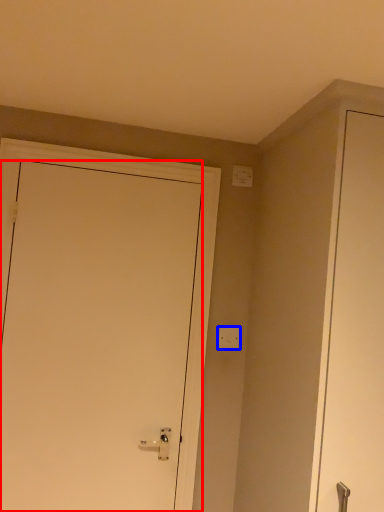
Question: Which object appears closest to the camera in this image, door (highlighted by a red box) or light switch (highlighted by a blue box)?

Choices:
 (A) door
 (B) light switch

Answer: (A)